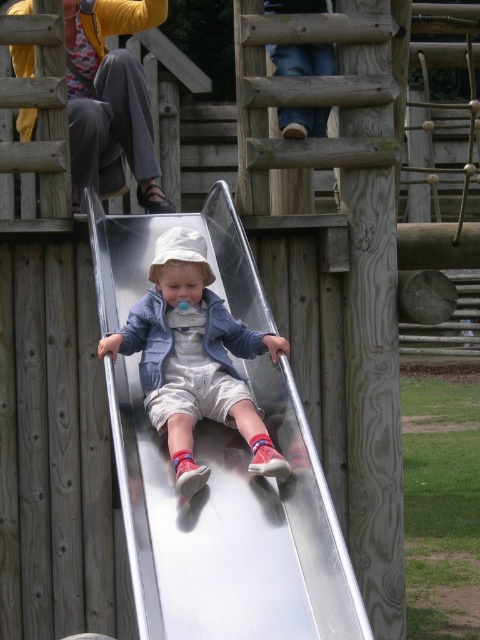
Is point (235, 472) more distant than point (233, 419)?

No, it is in front of (233, 419).

Who is higher up, silver metallic slide at center or metallic silver slide at center?

Positioned higher is silver metallic slide at center.

Locate an element on the screen. silver metallic slide at center is located at coordinates (231, 525).

You are a GUI agent. You are given a task and a screenshot of the screen. Output one action in this format:
    pyautogui.click(x=<x>, y=<y>)
    Task: Click on the silver metallic slide at center
    This screenshot has height=640, width=480.
    Given the screenshot: What is the action you would take?
    pyautogui.click(x=231, y=525)